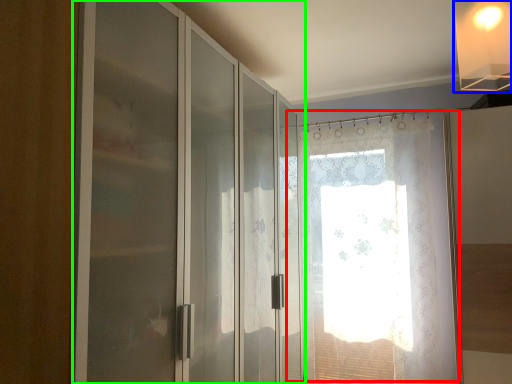
Question: Considering the real-world distances, which object is farthest from window (highlighted by a red box)? light fixture (highlighted by a blue box) or door (highlighted by a green box)?

Choices:
 (A) light fixture
 (B) door

Answer: (A)